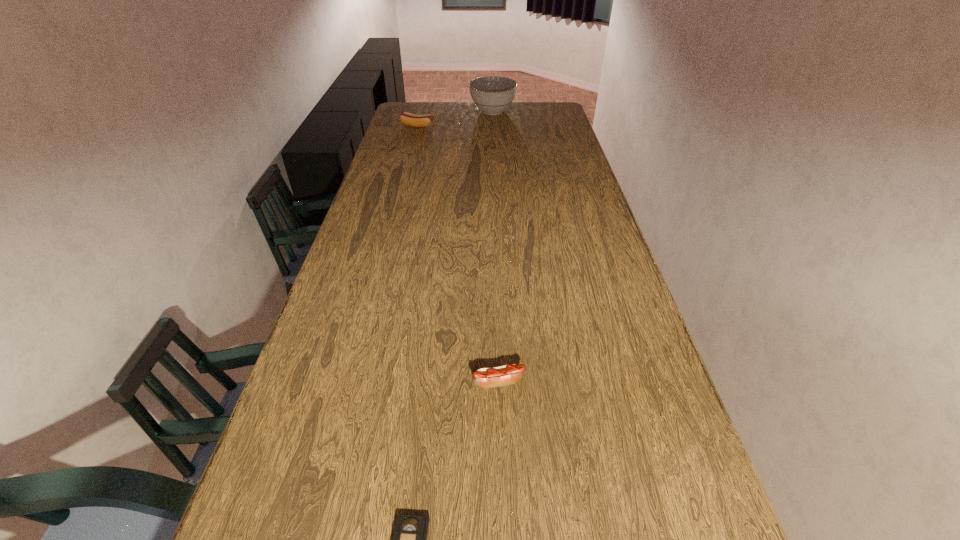
At what (x,y) coordinates should I click in order to perform the action: click on the third closest object to the leftmost object. Please return your answer as a coordinate pair (x, y). This screenshot has height=540, width=960. Looking at the image, I should click on (409, 539).

You are a GUI agent. You are given a task and a screenshot of the screen. Output one action in this format:
    pyautogui.click(x=<x>, y=<y>)
    Task: Click on the object identified as the closest to the tallest object
    The image size is (960, 540).
    Given the screenshot: What is the action you would take?
    pyautogui.click(x=410, y=119)

Locate an element on the screen. vacant region that satisfies the following two spatial constraints: 1. on the front side of the second farthest object; 2. on the right side of the shorter sausage is located at coordinates (349, 382).

Locate an element on the screen. The width and height of the screenshot is (960, 540). vacant region that satisfies the following two spatial constraints: 1. on the back side of the farther sausage; 2. on the right side of the tallest object is located at coordinates (421, 111).